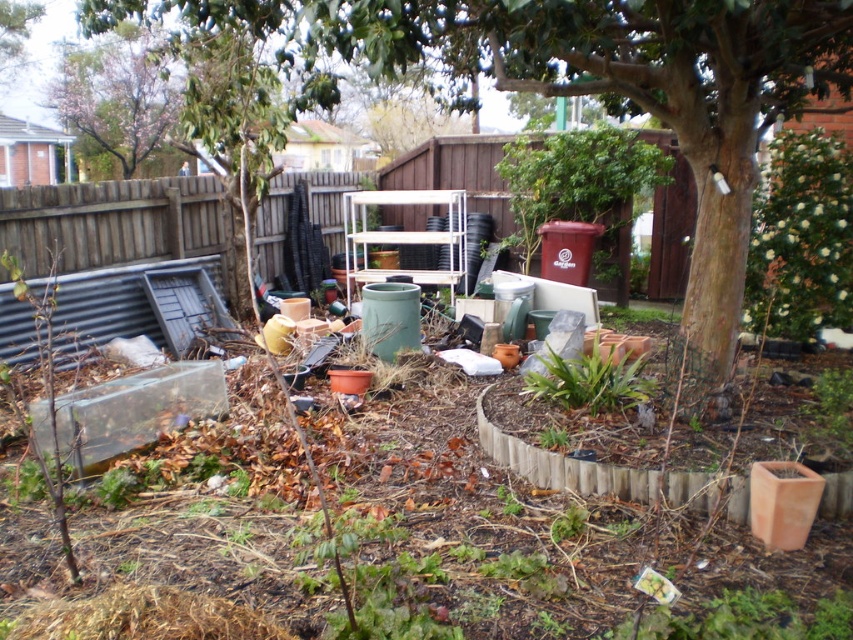
Which is more to the left, cherry blossom tree at upper left or terracotta clay planter at lower right?

cherry blossom tree at upper left

Between point (131, 115) and point (769, 502), which one is positioned behind?

The point (131, 115) is more distant.

Which is behind, point (154, 147) or point (799, 508)?

The point (154, 147) is behind.

Image resolution: width=853 pixels, height=640 pixels. What are the coordinates of `cherry blossom tree at upper left` in the screenshot? It's located at (119, 100).

Does brown wooden fence at upper left appear on the left side of green leafy plant at center?

Correct, you'll find brown wooden fence at upper left to the left of green leafy plant at center.

Can you confirm if brown wooden fence at upper left is taller than green leafy plant at center?

Correct, brown wooden fence at upper left is much taller as green leafy plant at center.

Describe the element at coordinates (111, 221) in the screenshot. The height and width of the screenshot is (640, 853). I see `brown wooden fence at upper left` at that location.

Where is `brown wooden fence at upper left`? The image size is (853, 640). brown wooden fence at upper left is located at coordinates (111, 221).

Does brown wooden fence at upper left appear under cherry blossom tree at upper left?

Yes.

The height and width of the screenshot is (640, 853). I want to click on brown wooden fence at upper left, so click(x=111, y=221).

This screenshot has height=640, width=853. What are the coordinates of `brown wooden fence at upper left` in the screenshot? It's located at (111, 221).